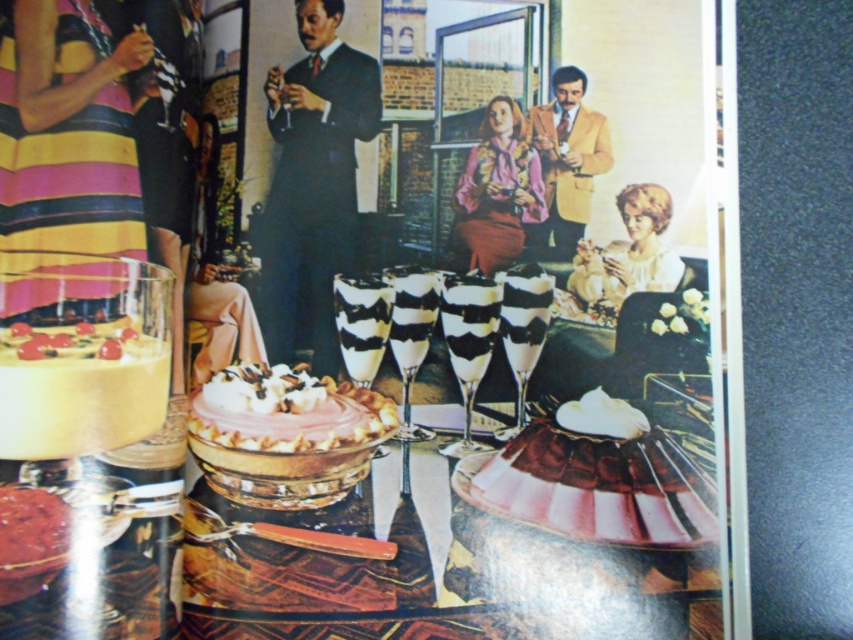
Question: Does smooth black suit at center appear on the left side of velvet pink skirt at lower center?

Choices:
 (A) yes
 (B) no

Answer: (A)

Question: Which point is farther to the camera?

Choices:
 (A) (358, 570)
 (B) (331, 284)

Answer: (B)

Question: Estimate the real-world distances between objects in this image. Which object is farther from the yellow textured blazer at upper right?

Choices:
 (A) shiny glass table at center
 (B) smooth black suit at center
 (C) smooth chocolate cake at lower left

Answer: (C)

Question: Is pink frosted pie at center in front of yellow textured blazer at upper right?

Choices:
 (A) yes
 (B) no

Answer: (A)

Question: Does shiny glass table at center have a greater width compared to smooth chocolate cake at lower left?

Choices:
 (A) no
 (B) yes

Answer: (B)

Question: Which point is farther to the camera?

Choices:
 (A) smooth black suit at center
 (B) yellow textured blazer at upper right
 (C) velvet pink skirt at lower center
 (D) shiny glass table at center

Answer: (B)